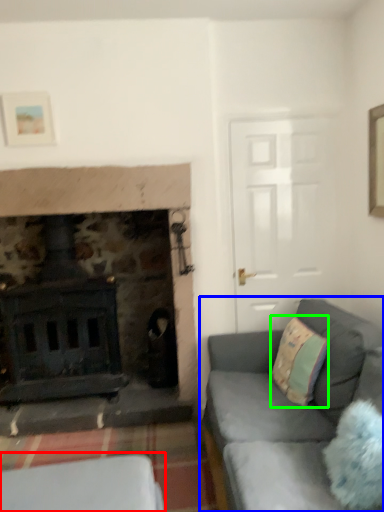
Question: Considering the real-world distances, which object is closest to furniture (highlighted by a red box)? studio couch (highlighted by a blue box) or throw pillow (highlighted by a green box).

Choices:
 (A) studio couch
 (B) throw pillow

Answer: (A)